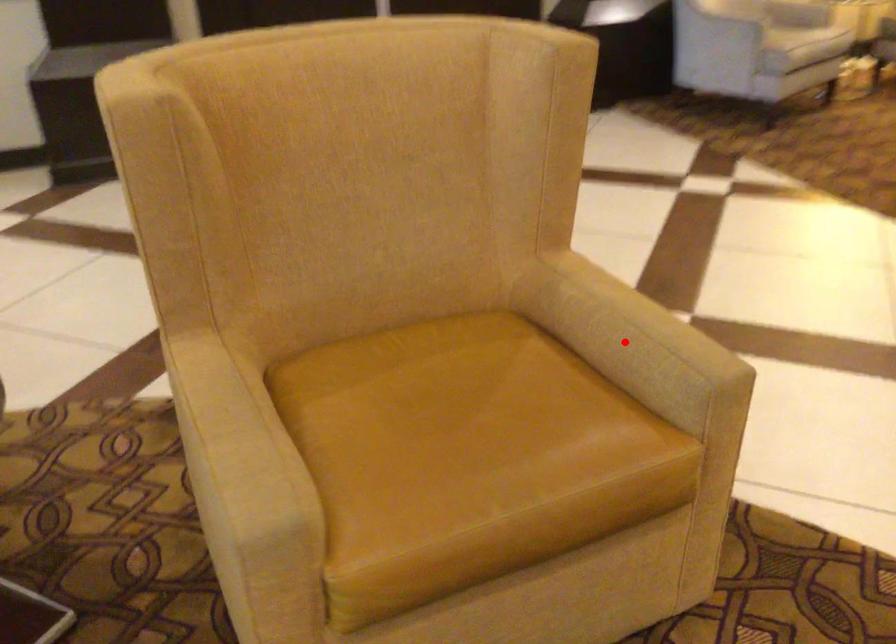
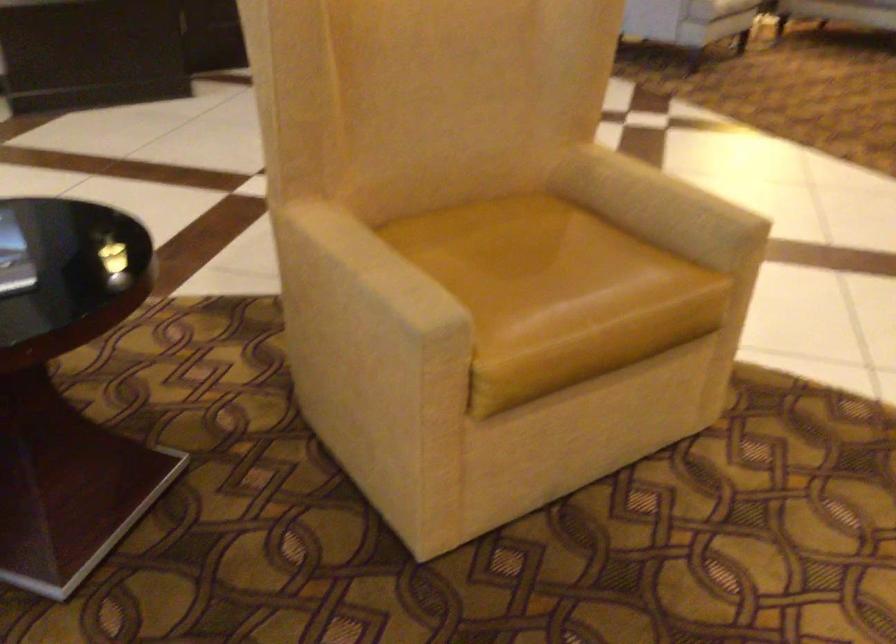
Question: I am providing you with two images of the same scene from different viewpoints. A red point is shown in image1. For the corresponding object point in image2, is it positioned nearer or farther from the camera?

Choices:
 (A) Nearer
 (B) Farther

Answer: (B)